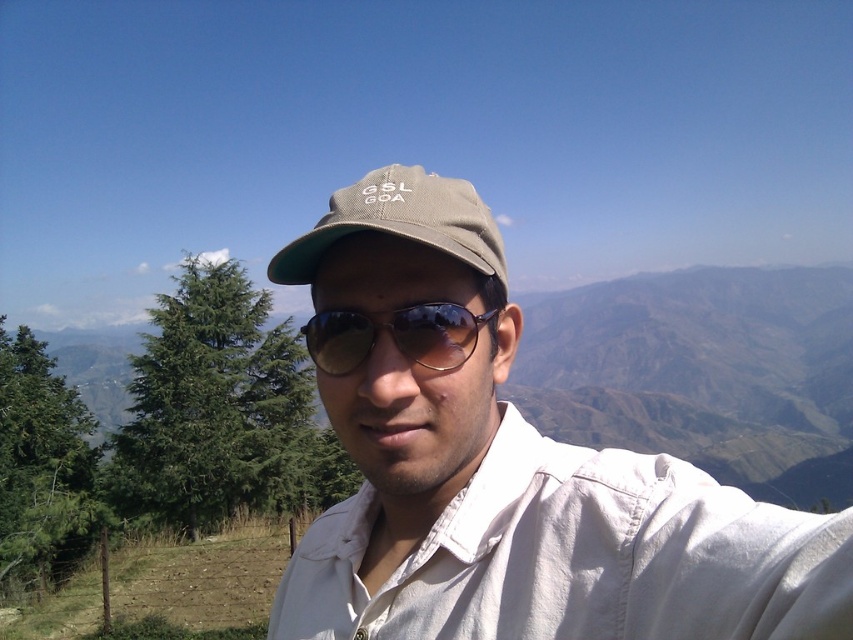
Does matte khaki cap at center have a lesser width compared to khaki fabric cap at center?

No.

How much distance is there between matte khaki cap at center and khaki fabric cap at center?

The distance of matte khaki cap at center from khaki fabric cap at center is 2.12 meters.

Is point (672, 634) farther from viewer compared to point (402, 232)?

No, it is not.

This screenshot has width=853, height=640. I want to click on matte khaki cap at center, so click(506, 467).

Is khaki fabric cap at center to the left of sunglasses at center from the viewer's perspective?

Yes, khaki fabric cap at center is to the left of sunglasses at center.

Is khaki fabric cap at center further to camera compared to sunglasses at center?

That is True.

Is point (451, 209) positioned before point (315, 333)?

Yes.

Find the location of `khaki fabric cap at center`. khaki fabric cap at center is located at coordinates (401, 224).

Who is more distant from viewer, (527, 566) or (448, 332)?

Positioned behind is point (448, 332).

Who is positioned more to the left, matte khaki cap at center or sunglasses at center?

Positioned to the left is matte khaki cap at center.

This screenshot has height=640, width=853. What are the coordinates of `matte khaki cap at center` in the screenshot? It's located at (x=506, y=467).